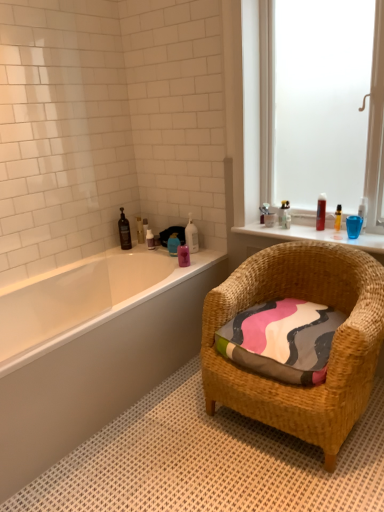
I want to click on free space to the left of shiny brown bottle at left, marked as the tenth toiletry in a right-to-left arrangement, so click(107, 252).